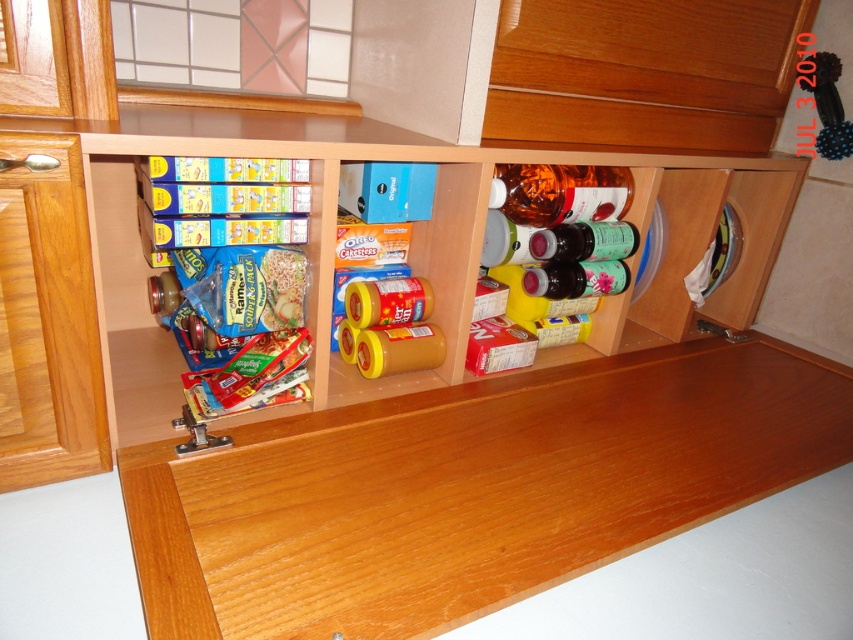
Please provide the 2D coordinates of the wooden cabinet at center in the image. The coordinates should be in the format of a point with two decimal places, like this example format. Please do not add any extra text or explanation, just the coordinates in the format specified.

The 2D coordinates of the wooden cabinet at center are at point [479,237].

In the scene shown: You are a delivery person who needs to place a new jar of pickles that is 50 centimeters tall into the cabinet. The jar must be placed exactly where the wooden at center currently is. Is there enough space for the jar?

The distance between wooden at center and the camera is 49.53 centimeters, so the jar cannot be placed there because it is slightly shorter than the required space.

You are organizing the cabinet and need to place a tall container that requires more vertical space. Which object in the cabinet, the wooden at center or the wooden drawer at lower left, should you place it in?

The wooden at center is located below the wooden drawer at lower left, so the wooden drawer at lower left has more vertical space above it. Place the tall container in the wooden drawer at lower left.